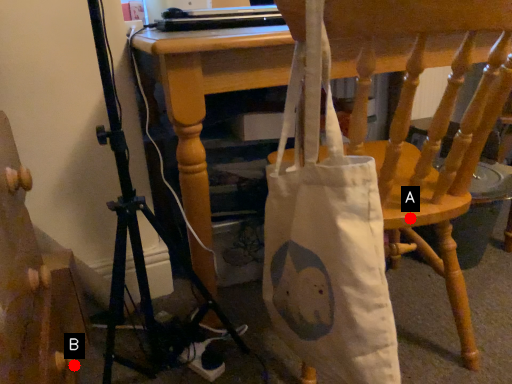
Question: Two points are circled on the image, labeled by A and B beside each circle. Which point is closer to the camera?

Choices:
 (A) A is closer
 (B) B is closer

Answer: (A)